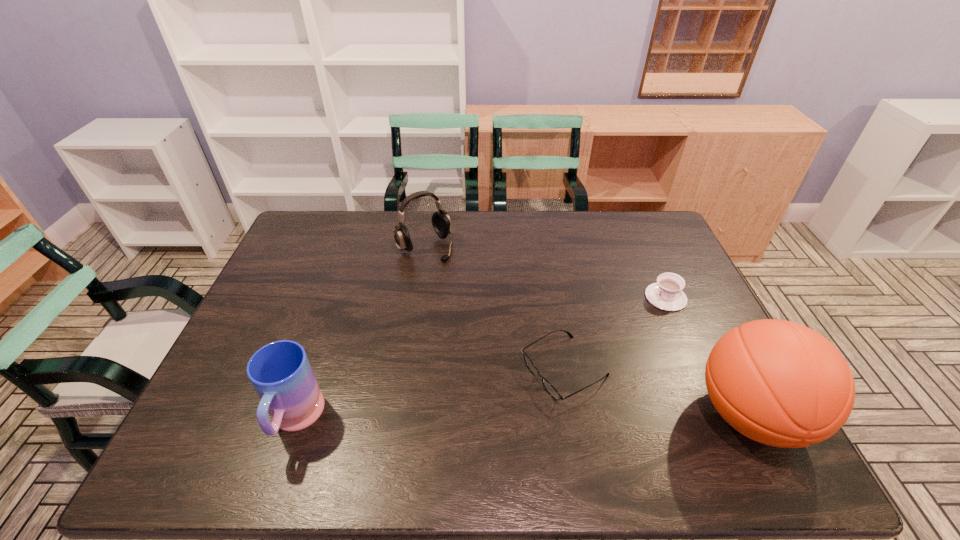
The width and height of the screenshot is (960, 540). I want to click on basketball situated at the near edge, so click(x=779, y=383).

At what (x,y) coordinates should I click in order to perform the action: click on spectacles at the near edge. Please return your answer as a coordinate pair (x, y). Image resolution: width=960 pixels, height=540 pixels. Looking at the image, I should click on (549, 388).

Find the location of a particular element. This screenshot has width=960, height=540. basketball located at the right edge is located at coordinates (779, 383).

The width and height of the screenshot is (960, 540). Identify the location of teacup at the right edge. (666, 294).

Image resolution: width=960 pixels, height=540 pixels. In order to click on object located at the near right corner in this screenshot , I will do `click(779, 383)`.

You are a GUI agent. You are given a task and a screenshot of the screen. Output one action in this format:
    pyautogui.click(x=<x>, y=<y>)
    Task: Click on the free space at the far edge of the desktop
    The height and width of the screenshot is (540, 960).
    Given the screenshot: What is the action you would take?
    pyautogui.click(x=378, y=219)

You are a GUI agent. You are given a task and a screenshot of the screen. Output one action in this format:
    pyautogui.click(x=<x>, y=<y>)
    Task: Click on the free spot at the near edge of the desktop
    Image resolution: width=960 pixels, height=540 pixels.
    Given the screenshot: What is the action you would take?
    pyautogui.click(x=616, y=417)

In the image, there is a desktop. At what (x,y) coordinates should I click in order to perform the action: click on vacant space at the right edge. Please return your answer as a coordinate pair (x, y). The height and width of the screenshot is (540, 960). Looking at the image, I should click on (633, 253).

You are a GUI agent. You are given a task and a screenshot of the screen. Output one action in this format:
    pyautogui.click(x=<x>, y=<y>)
    Task: Click on the vacant region at the far left corner of the desktop
    
    Given the screenshot: What is the action you would take?
    pyautogui.click(x=300, y=226)

Locate an element on the screen. This screenshot has height=540, width=960. vacant area that lies between the spectacles and the teacup is located at coordinates (615, 334).